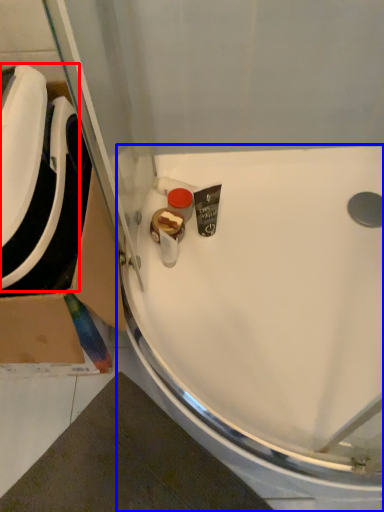
Question: Among these objects, which one is nearest to the camera, sink (highlighted by a red box) or sink (highlighted by a blue box)?

Choices:
 (A) sink
 (B) sink

Answer: (A)